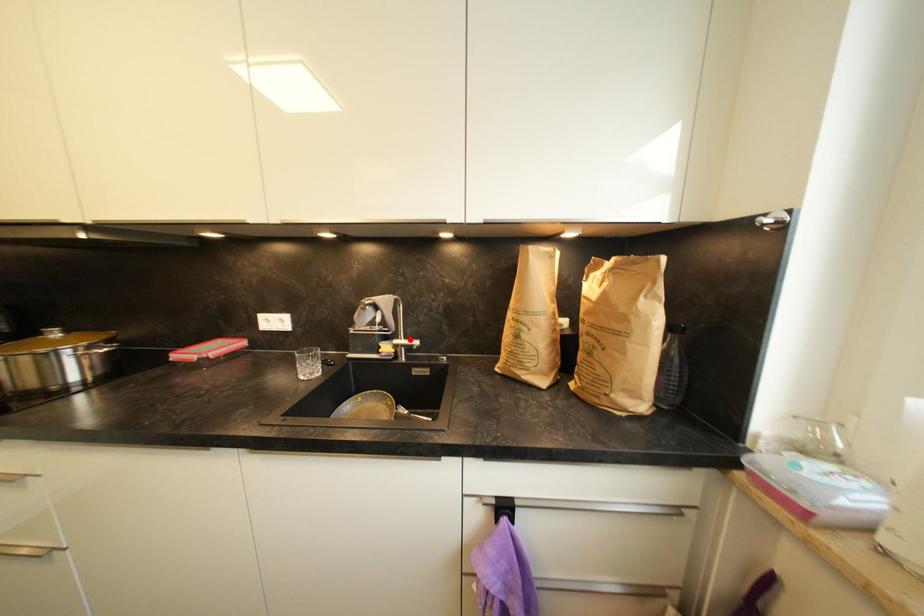
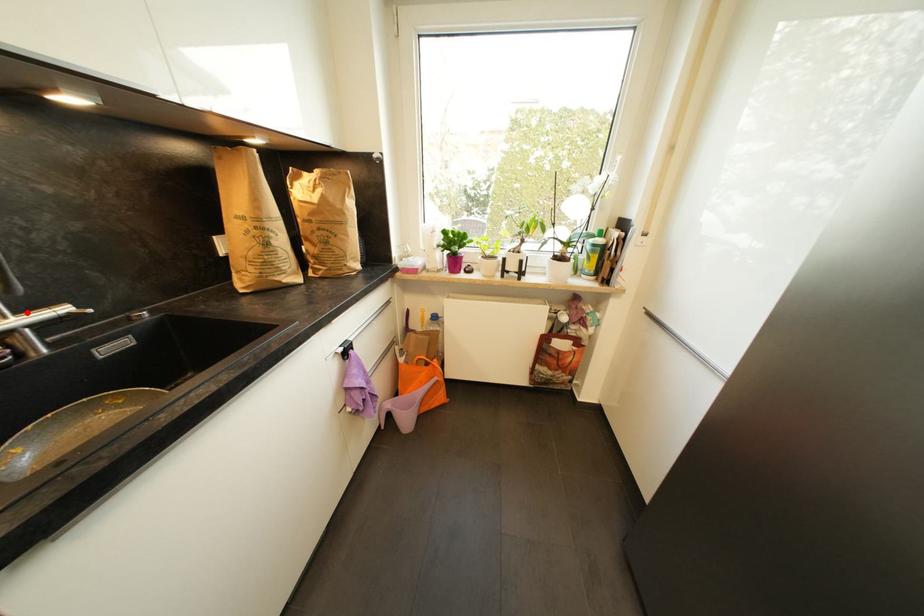
I am providing you with two images of the same scene from different viewpoints. A red point is marked on the first image and another point is marked on the second image. Does the point marked in image1 correspond to the same location as the one in image2?

Yes